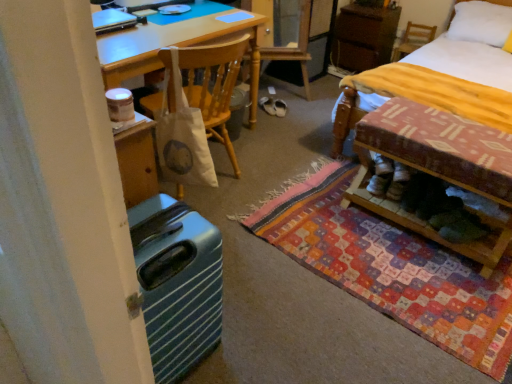
In order to click on free point to the left of wooden bed frame at lower right in this screenshot , I will do `click(329, 222)`.